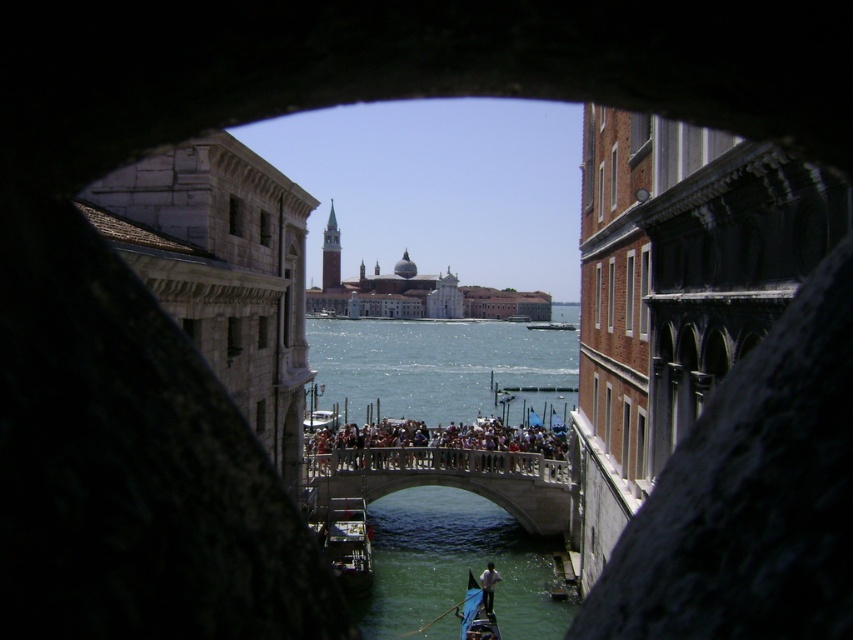
You are a photographer standing at the bridge and want to capture both the metallic polished boat at center and the white fabric shirt at lower center in a single photo. However, your camera has a limited depth of field. Which object should you focus on to ensure it appears sharp while the other is slightly blurred?

You should focus on the metallic polished boat at center because it is much taller than the white fabric shirt at lower center, so focusing on the taller object will keep it sharp while the shorter one may blur slightly due to the limited depth of field.

You are standing in the middle of the canal and want to reach the stone bridge at center. According to the image, in which direction should you head to reach it?

The stone bridge at center is located at coordinates 0.748 on the x axis and 0.528 on the y axis. Since you are in the middle of the canal, you should head towards the direction of the stone bridge at center which is at those coordinates.

You are standing on a boat in the canal and want to reach the stone bridge at center. The boat can travel 10 meters per minute. How many minutes will it take you to reach the bridge?

The stone bridge at center is 86.94 meters away from the viewer. Since the boat travels at 10 meters per minute, it will take approximately 8.69 minutes to reach the bridge.